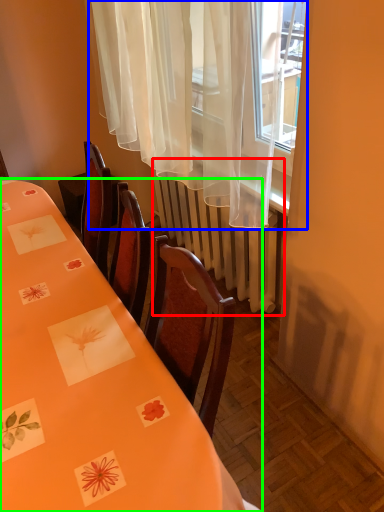
Question: Considering the real-world distances, which object is closest to radiator (highlighted by a red box)? curtain (highlighted by a blue box) or table (highlighted by a green box).

Choices:
 (A) curtain
 (B) table

Answer: (A)